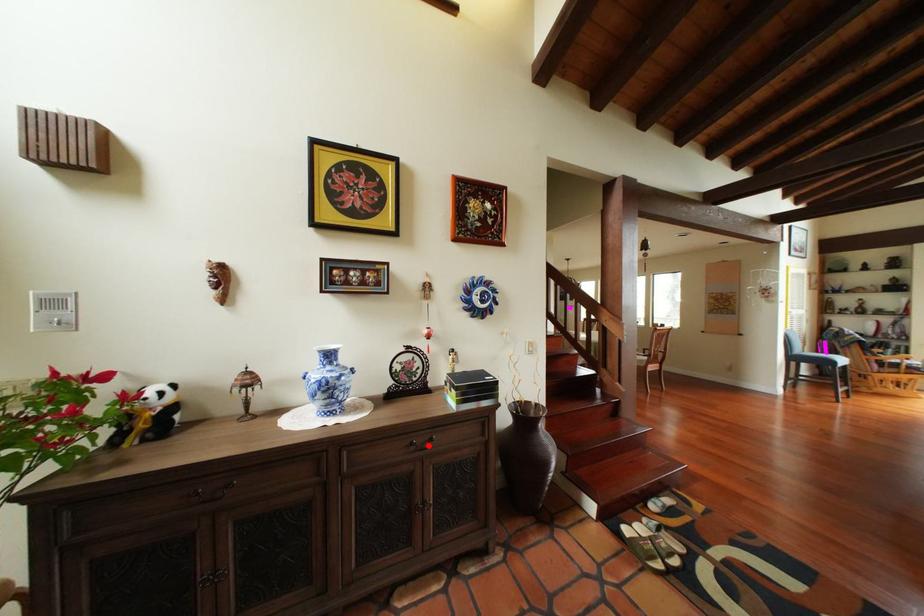
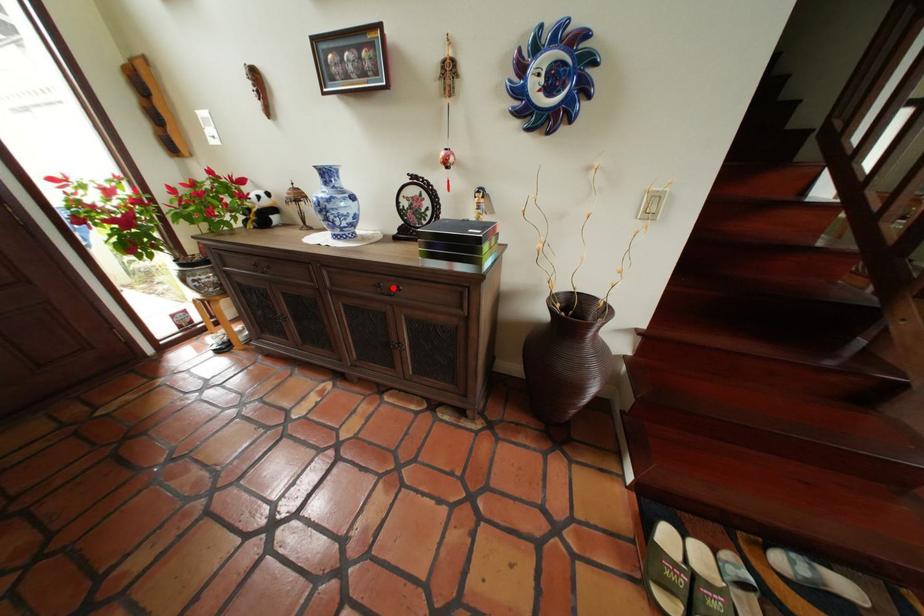
I am providing you with two images of the same scene from different viewpoints. A red point is marked on the first image and another point is marked on the second image. Is the red point in image1 aligned with the point shown in image2?

Yes